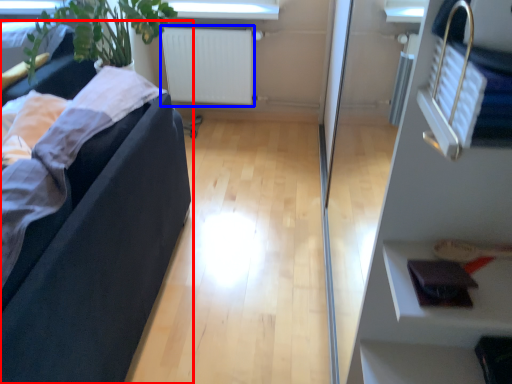
Question: Which of the following is the farthest to the observer, studio couch (highlighted by a red box) or radiator (highlighted by a blue box)?

Choices:
 (A) studio couch
 (B) radiator

Answer: (B)